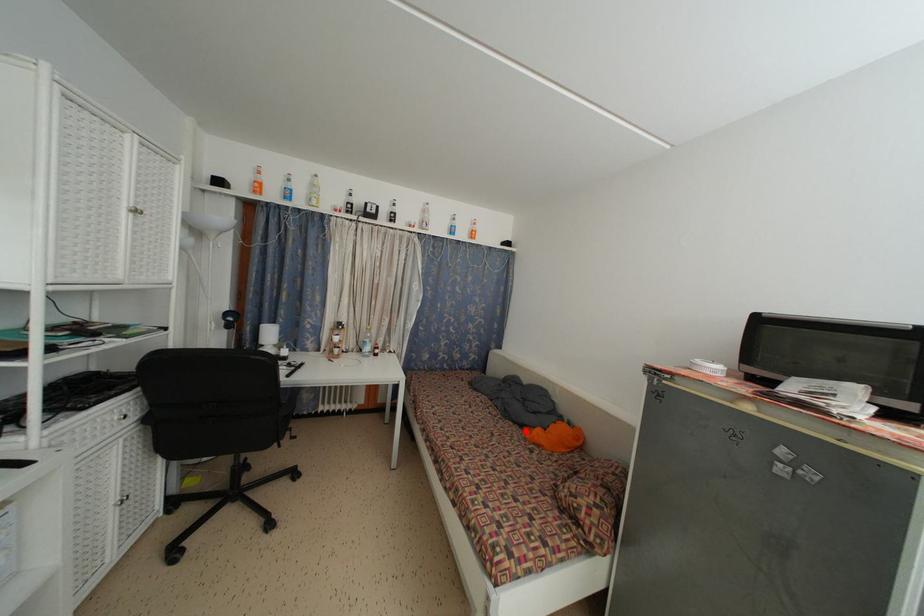
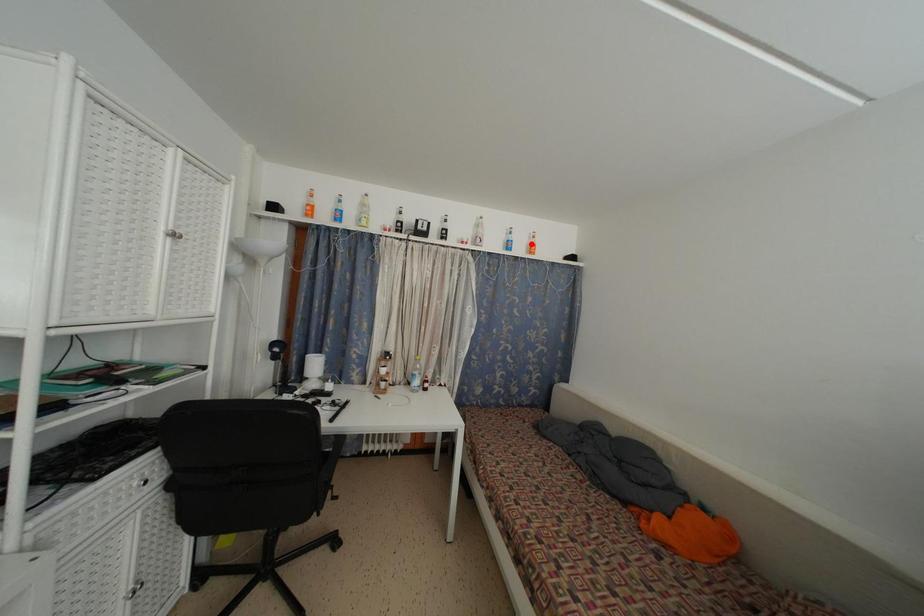
I am providing you with two images of the same scene from different viewpoints. A red point is marked on the first image and another point is marked on the second image. Is the marked point in image1 the same physical position as the marked point in image2?

No